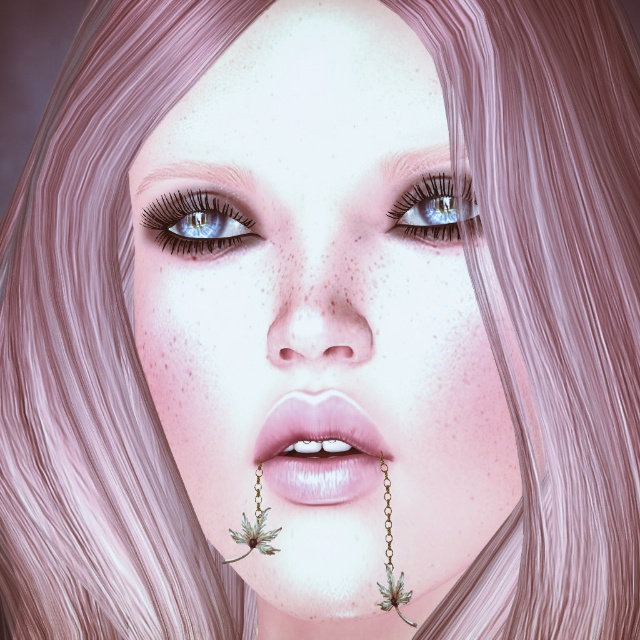
Question: Is shiny blue eye at upper left wider than gold chain leaf at lower center?

Choices:
 (A) no
 (B) yes

Answer: (B)

Question: Can you confirm if shiny blue eye at upper left is smaller than blue glossy eye at upper center?

Choices:
 (A) no
 (B) yes

Answer: (A)

Question: Does matte pink lips at center have a greater width compared to shiny blue eye at upper left?

Choices:
 (A) no
 (B) yes

Answer: (B)

Question: Which of the following is the closest to the observer?

Choices:
 (A) gold chain leaf at lower center
 (B) gold metallic leaf at lower center
 (C) smooth skin face at center
 (D) blue glossy eye at upper center

Answer: (C)

Question: Which object appears farthest from the camera in this image?

Choices:
 (A) shiny blue eye at upper left
 (B) gold metallic leaf at lower center
 (C) blue glossy eye at upper center
 (D) gold chain leaf at lower center

Answer: (A)

Question: Which point appears farthest from the camera in this image?

Choices:
 (A) click(x=285, y=436)
 (B) click(x=259, y=484)

Answer: (B)